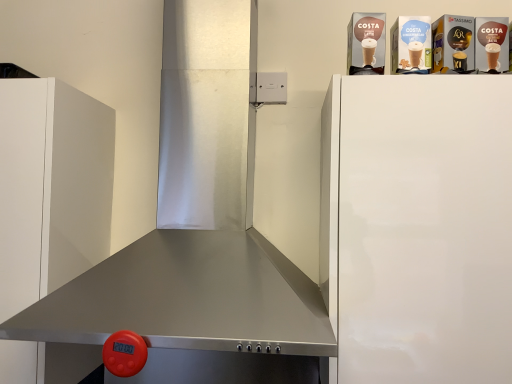
Question: From a real-world perspective, is white matte cabinet at left physically below white glossy refrigerator at upper right?

Choices:
 (A) yes
 (B) no

Answer: (B)

Question: Can you see white matte cabinet at left touching white glossy refrigerator at upper right?

Choices:
 (A) no
 (B) yes

Answer: (A)

Question: Considering the relative sizes of white matte cabinet at left and white glossy refrigerator at upper right in the image provided, is white matte cabinet at left taller than white glossy refrigerator at upper right?

Choices:
 (A) no
 (B) yes

Answer: (B)

Question: From a real-world perspective, is white matte cabinet at left on top of white glossy refrigerator at upper right?

Choices:
 (A) no
 (B) yes

Answer: (B)

Question: Is the depth of white matte cabinet at left greater than that of white glossy refrigerator at upper right?

Choices:
 (A) yes
 (B) no

Answer: (A)

Question: Does white matte cabinet at left lie in front of white glossy refrigerator at upper right?

Choices:
 (A) yes
 (B) no

Answer: (B)

Question: From a real-world perspective, is white glossy refrigerator at upper right positioned over white matte cabinet at left based on gravity?

Choices:
 (A) yes
 (B) no

Answer: (B)

Question: Would you say white glossy refrigerator at upper right is a long distance from white matte cabinet at left?

Choices:
 (A) no
 (B) yes

Answer: (A)

Question: Is white glossy refrigerator at upper right surrounding white matte cabinet at left?

Choices:
 (A) yes
 (B) no

Answer: (B)

Question: Is white glossy refrigerator at upper right at the left side of white matte cabinet at left?

Choices:
 (A) yes
 (B) no

Answer: (B)

Question: Does white glossy refrigerator at upper right have a larger size compared to white matte cabinet at left?

Choices:
 (A) no
 (B) yes

Answer: (B)

Question: Is white glossy refrigerator at upper right positioned beyond the bounds of white matte cabinet at left?

Choices:
 (A) no
 (B) yes

Answer: (B)

Question: From a real-world perspective, is white matte cabinet at left beneath stainless steel exhaust hood at center?

Choices:
 (A) no
 (B) yes

Answer: (B)